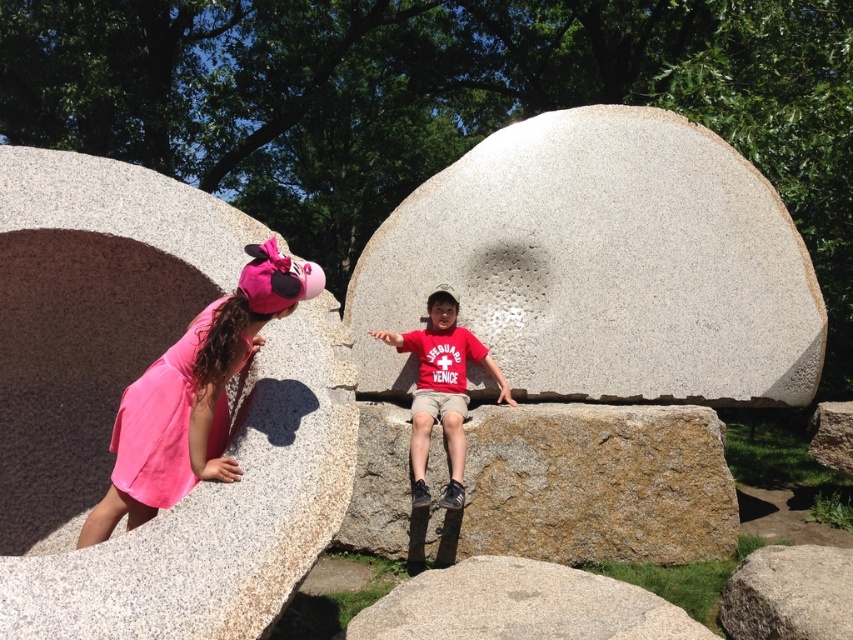
Does gray granite rock at lower center have a greater height compared to red cotton shirt at center?

Incorrect, gray granite rock at lower center's height is not larger of red cotton shirt at center's.

Who is more distant from viewer, (460, 592) or (465, 449)?

Positioned behind is point (465, 449).

Where is `gray granite rock at lower center`? The width and height of the screenshot is (853, 640). gray granite rock at lower center is located at coordinates (520, 605).

I want to click on gray granite rock at lower center, so click(x=520, y=605).

Which is in front, point (144, 435) or point (672, 625)?

Positioned in front is point (144, 435).

Is point (233, 332) positioned in front of point (682, 630)?

Yes, point (233, 332) is in front of point (682, 630).

You are a GUI agent. You are given a task and a screenshot of the screen. Output one action in this format:
    pyautogui.click(x=<x>, y=<y>)
    Task: Click on the pink fabric dress at left
    
    Given the screenshot: What is the action you would take?
    pyautogui.click(x=193, y=396)

Can you confirm if gray granite stone at center is shorter than gray granite rock at center?

No.

This screenshot has height=640, width=853. I want to click on gray granite stone at center, so click(601, 266).